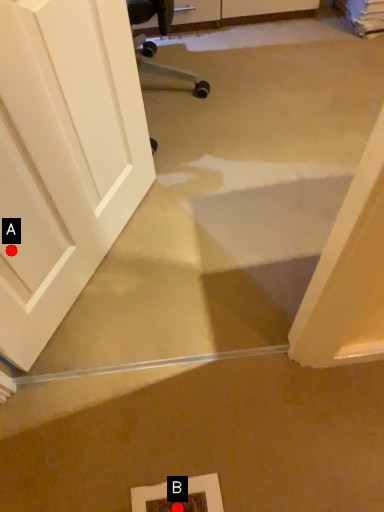
Question: Two points are circled on the image, labeled by A and B beside each circle. Which point is closer to the camera?

Choices:
 (A) A is closer
 (B) B is closer

Answer: (A)